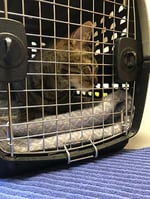
The image size is (150, 199). Identify the location of door hinge. (10, 141).